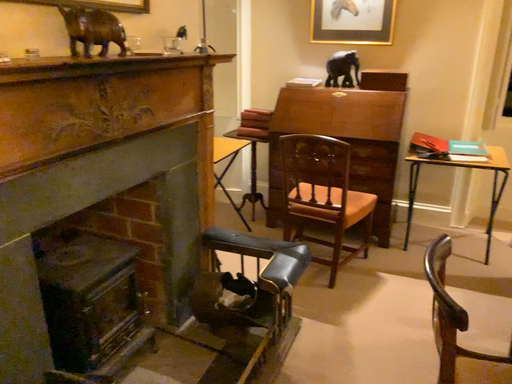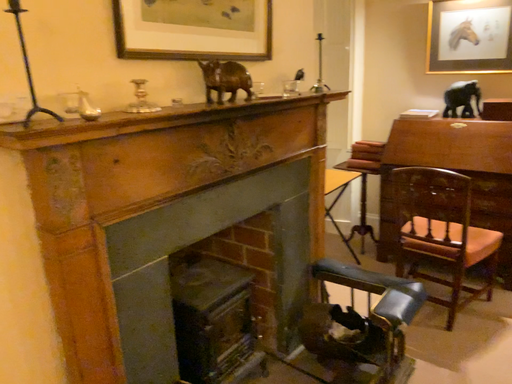
Question: How did the camera likely rotate when shooting the video?

Choices:
 (A) rotated left
 (B) rotated right

Answer: (A)